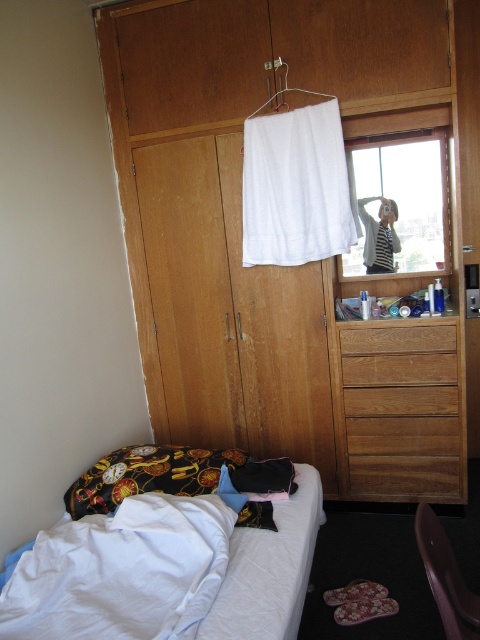
Who is higher up, brown wooden drawer at right or transparent glass window at upper center?

transparent glass window at upper center is higher up.

Identify the location of brown wooden drawer at right. (405, 412).

Who is more distant from viewer, (394,337) or (360,264)?

The point (360,264) is behind.

The image size is (480, 640). Identify the location of brown wooden drawer at right. (405, 412).

Is velvet blue pillow at lower center to the left of white fabric hanger at upper center from the viewer's perspective?

Indeed, velvet blue pillow at lower center is positioned on the left side of white fabric hanger at upper center.

Which is behind, point (224, 477) or point (285, 67)?

The point (285, 67) is behind.

Is point (242, 467) closer to camera compared to point (285, 88)?

That is True.

Where is `velvet blue pillow at lower center`? This screenshot has width=480, height=640. velvet blue pillow at lower center is located at coordinates (244, 504).

Is point (247, 144) closer to camera compared to point (396, 228)?

Yes.

Does white fabric towel at upper center have a smaller size compared to transparent glass window at upper center?

Yes, white fabric towel at upper center is smaller than transparent glass window at upper center.

Describe the element at coordinates (296, 186) in the screenshot. I see `white fabric towel at upper center` at that location.

Locate an element on the screen. The height and width of the screenshot is (640, 480). white fabric towel at upper center is located at coordinates (296, 186).